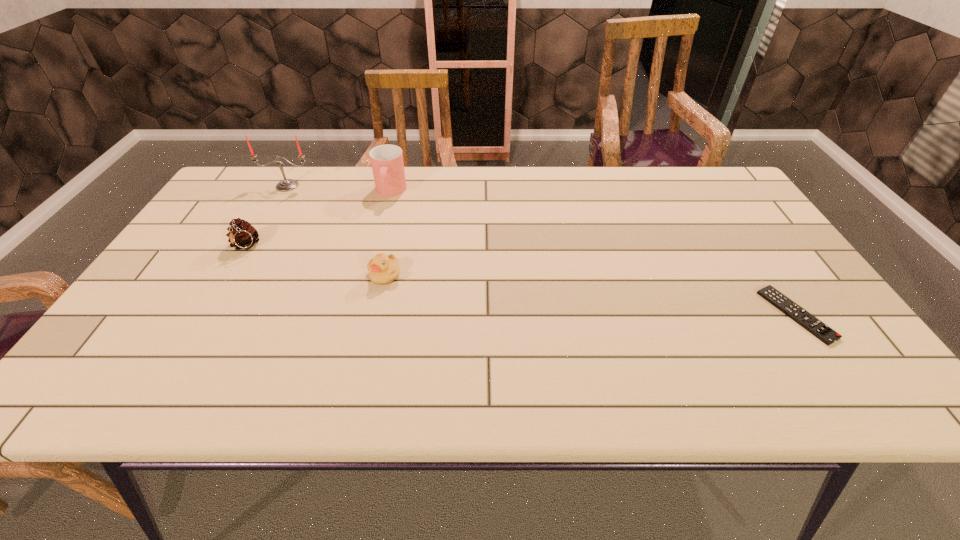
Where is `free point that satisfies the following two spatial constraints: 1. on the beak of the nearest object; 2. on the right side of the fourth farthest object`? Image resolution: width=960 pixels, height=540 pixels. free point that satisfies the following two spatial constraints: 1. on the beak of the nearest object; 2. on the right side of the fourth farthest object is located at coordinates (376, 315).

Identify the location of free space that satisfies the following two spatial constraints: 1. on the side of the shortest object with the handle; 2. on the left side of the cup. (358, 315).